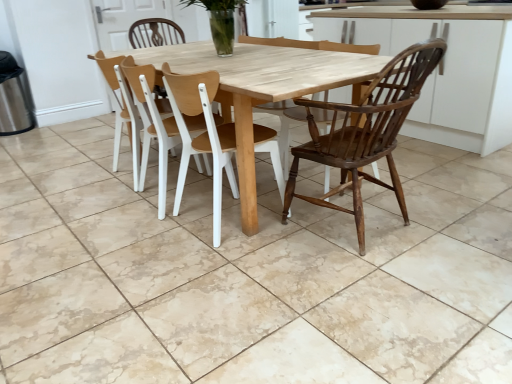
Where is `vacant space to the right of dark brown wood chair at right, the first chair in the right-to-left sequence`? vacant space to the right of dark brown wood chair at right, the first chair in the right-to-left sequence is located at coordinates (448, 222).